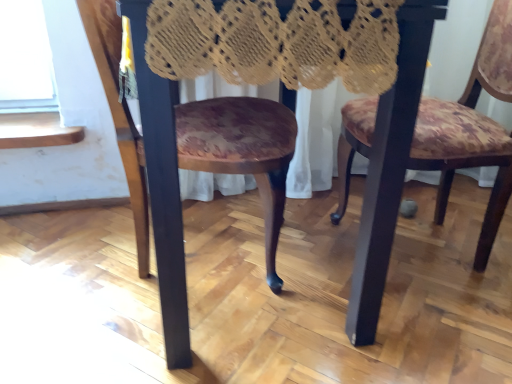
The image size is (512, 384). What are the coordinates of `vacant space in between wooden table at center and wooden floral-patterned chair at center, which is the second chair from right to left` in the screenshot? It's located at (134, 317).